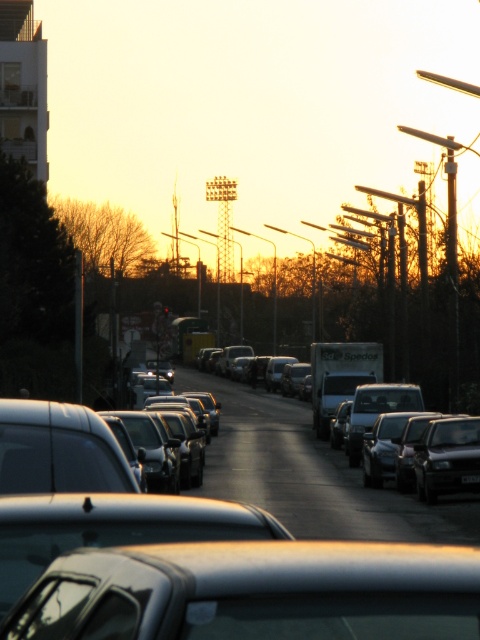
You are a delivery driver who needs to park your metallic silver car at center in a parking spot located at coordinates 0.925, 0.531. Based on the scene description, can you confirm if your car is already parked in the correct spot?

Yes, the metallic silver car at center is already parked at the coordinates (254,589), which matches the parking spot location.

You are standing on the sidewalk and see the metallic silver car at center and the matte black truck at center. Which one is positioned to the right side from your perspective?

The metallic silver car at center is positioned to the right of the matte black truck at center.